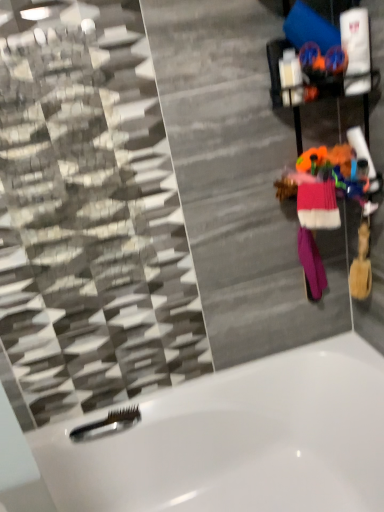
Question: Is black plastic comb at lower left at the right side of pink knitted sweater at right, the 1th clothing viewed from the front?

Choices:
 (A) no
 (B) yes

Answer: (A)

Question: Considering the relative sizes of black plastic comb at lower left and pink knitted sweater at right, the 1th clothing viewed from the front, in the image provided, is black plastic comb at lower left shorter than pink knitted sweater at right, the 1th clothing viewed from the front,?

Choices:
 (A) no
 (B) yes

Answer: (B)

Question: Is pink knitted sweater at right, the 1th clothing viewed from the front, a part of black plastic comb at lower left?

Choices:
 (A) no
 (B) yes

Answer: (A)

Question: Is pink knitted sweater at right, which is counted as the second clothing, starting from the back, at the back of black plastic comb at lower left?

Choices:
 (A) yes
 (B) no

Answer: (B)

Question: From a real-world perspective, is black plastic comb at lower left below pink knitted sweater at right, the 1th clothing viewed from the front?

Choices:
 (A) yes
 (B) no

Answer: (A)

Question: Does black plastic comb at lower left have a greater width compared to pink knitted sweater at right, which is counted as the second clothing, starting from the back?

Choices:
 (A) yes
 (B) no

Answer: (B)

Question: From the image's perspective, is purple knitted mittens at right, which ranks as the 2th clothing in front-to-back order, under white glossy bathtub at lower center?

Choices:
 (A) no
 (B) yes

Answer: (A)

Question: From a real-world perspective, is purple knitted mittens at right, placed as the 1th clothing when sorted from back to front, beneath white glossy bathtub at lower center?

Choices:
 (A) yes
 (B) no

Answer: (B)

Question: Is white glossy bathtub at lower center at the back of purple knitted mittens at right, placed as the 1th clothing when sorted from back to front?

Choices:
 (A) no
 (B) yes

Answer: (A)

Question: Is purple knitted mittens at right, which ranks as the 2th clothing in front-to-back order, surrounding white glossy bathtub at lower center?

Choices:
 (A) yes
 (B) no

Answer: (B)

Question: Considering the relative sizes of purple knitted mittens at right, placed as the 1th clothing when sorted from back to front, and white glossy bathtub at lower center in the image provided, is purple knitted mittens at right, placed as the 1th clothing when sorted from back to front, thinner than white glossy bathtub at lower center?

Choices:
 (A) yes
 (B) no

Answer: (A)

Question: Can you confirm if purple knitted mittens at right, which ranks as the 2th clothing in front-to-back order, is bigger than white glossy bathtub at lower center?

Choices:
 (A) yes
 (B) no

Answer: (B)

Question: Is purple knitted mittens at right, placed as the 1th clothing when sorted from back to front, at the right side of pink knitted sweater at right, which is counted as the second clothing, starting from the back?

Choices:
 (A) no
 (B) yes

Answer: (B)